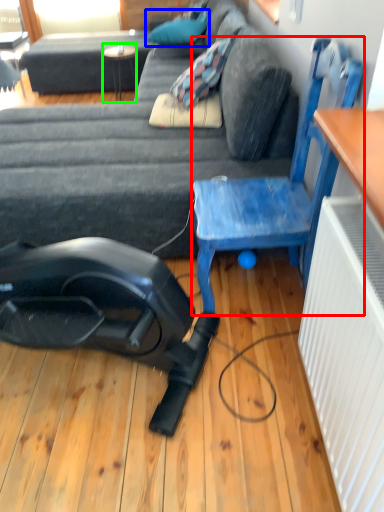
Question: Considering the real-world distances, which object is farthest from chair (highlighted by a red box)? pillow (highlighted by a blue box) or table (highlighted by a green box)?

Choices:
 (A) pillow
 (B) table

Answer: (B)